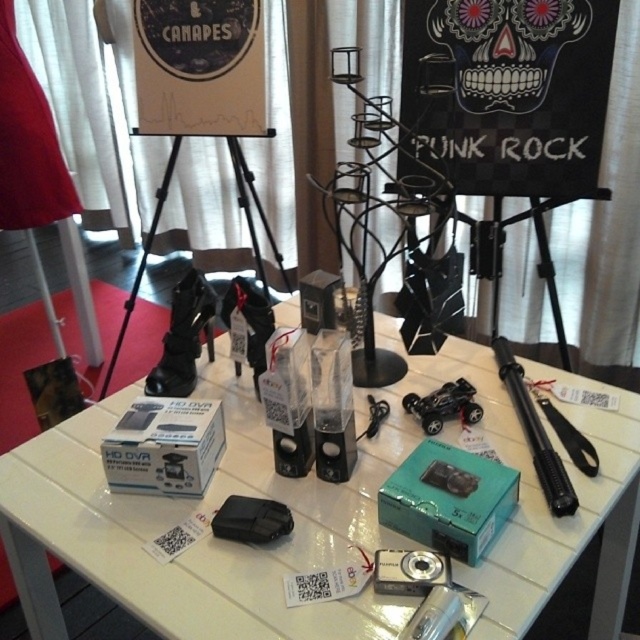
Can you confirm if white glossy table at center is shorter than black plastic toy car at center?

Incorrect, white glossy table at center's height does not fall short of black plastic toy car at center's.

Which is below, white glossy table at center or black plastic toy car at center?

Positioned lower is white glossy table at center.

Describe the element at coordinates (308, 518) in the screenshot. I see `white glossy table at center` at that location.

Image resolution: width=640 pixels, height=640 pixels. Find the location of `white glossy table at center`. white glossy table at center is located at coordinates (308, 518).

Is point (568, 532) closer to viewer compared to point (266, 132)?

Yes.

Where is `white glossy table at center`? white glossy table at center is located at coordinates pos(308,518).

Between black matte skull at upper center and black matte tripod at center, which one is positioned higher?

black matte skull at upper center

Does black matte skull at upper center appear on the left side of black matte tripod at center?

Incorrect, black matte skull at upper center is not on the left side of black matte tripod at center.

Which is behind, point (536, 60) or point (118, 346)?

Positioned behind is point (118, 346).

Where is `black matte skull at upper center`? The height and width of the screenshot is (640, 640). black matte skull at upper center is located at coordinates (506, 48).